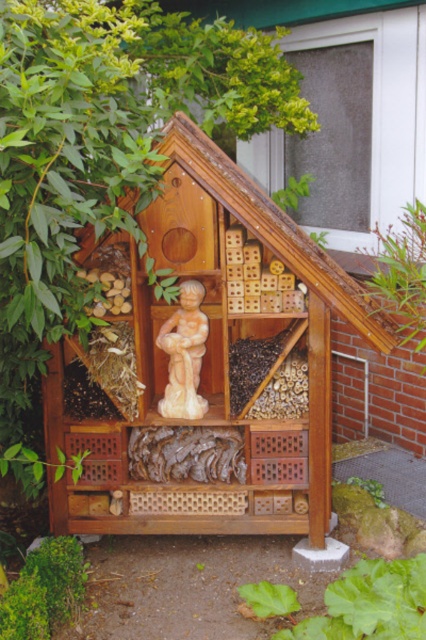
Question: Is green leafy plant at lower center smaller than green leafy bush at lower left?

Choices:
 (A) no
 (B) yes

Answer: (A)

Question: Considering the real-world distances, which object is farthest from the green leafy bush at lower left?

Choices:
 (A) green leafy plant at lower center
 (B) beige stone statue at center

Answer: (B)

Question: Which object is positioned farthest from the green leafy plant at lower center?

Choices:
 (A) green leafy bush at lower left
 (B) beige stone statue at center

Answer: (B)

Question: Does green leafy plant at lower center have a smaller size compared to beige stone statue at center?

Choices:
 (A) no
 (B) yes

Answer: (A)

Question: Which object appears closest to the camera in this image?

Choices:
 (A) green leafy bush at lower left
 (B) green leafy plant at lower center

Answer: (B)

Question: Does green leafy plant at lower center have a lesser width compared to beige stone statue at center?

Choices:
 (A) no
 (B) yes

Answer: (A)